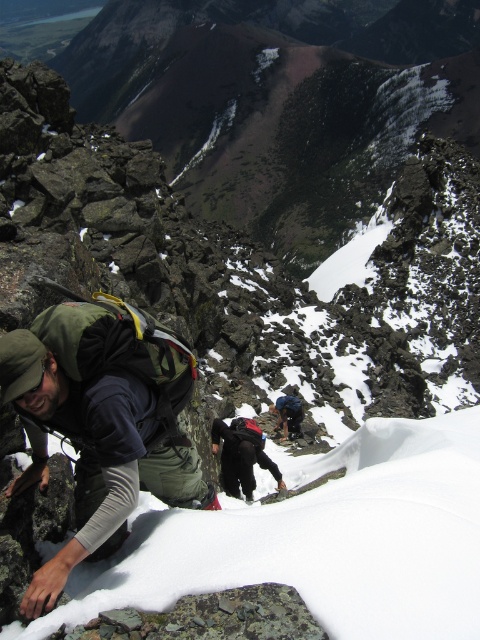
What are the coordinates of `dark gray fabric backpack at center` in the screenshot? It's located at (241, 456).

Does dark gray fabric backpack at center have a greater width compared to dark blue ski suit at center?

Correct, the width of dark gray fabric backpack at center exceeds that of dark blue ski suit at center.

Who is more forward, [220,435] or [282,404]?

Point [220,435] is more forward.

Where is `dark gray fabric backpack at center`? dark gray fabric backpack at center is located at coordinates (241, 456).

This screenshot has width=480, height=640. Describe the element at coordinates (93, 408) in the screenshot. I see `green fabric backpack at left` at that location.

Who is positioned more to the left, green fabric backpack at left or dark gray fabric backpack at center?

green fabric backpack at left

Where is `green fabric backpack at left`? This screenshot has width=480, height=640. green fabric backpack at left is located at coordinates (93, 408).

Consider the image. Between green fabric backpack at left and dark blue ski suit at center, which one is positioned higher?

green fabric backpack at left is higher up.

Can you confirm if green fabric backpack at left is taller than dark blue ski suit at center?

Correct, green fabric backpack at left is much taller as dark blue ski suit at center.

Describe the element at coordinates (93, 408) in the screenshot. Image resolution: width=480 pixels, height=640 pixels. I see `green fabric backpack at left` at that location.

Locate an element on the screen. This screenshot has height=640, width=480. green fabric backpack at left is located at coordinates (93, 408).